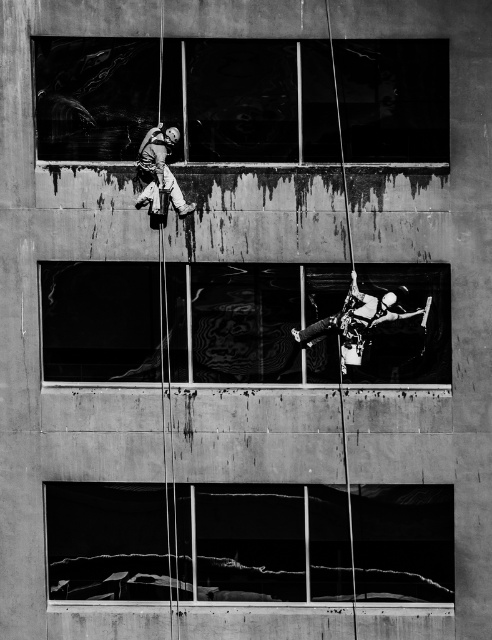
You are a safety inspector reviewing this image of window maintenance. You notice the transparent glass window at center and the matte gray climbing harness at upper center. Which object is located higher in the image?

The matte gray climbing harness at upper center is positioned higher than the transparent glass window at center, as it is above it in the image.

You are a window cleaner on the building depicted in the image. You need to reach both the point at coordinates [389,545] and the point at coordinates [97,339]. Which point should you climb closer to first to ensure you can reach both efficiently?

You should climb closer to point [97,339] first because it is closer to you than point [389,545], which is further away. By starting with the closer point, you can then move upward to reach the farther one without needing to backtrack.

You are a window cleaner with a ladder that is 1.5 meters long. You need to clean both the transparent glass window at lower center and the transparent glass window at center. Can you reach both windows with the ladder without moving it?

The transparent glass window at lower center and transparent glass window at center are 1.39 meters apart from each other. Since the ladder is 1.5 meters long, which is longer than the distance between the two windows, you can reach both windows with the ladder without moving it.